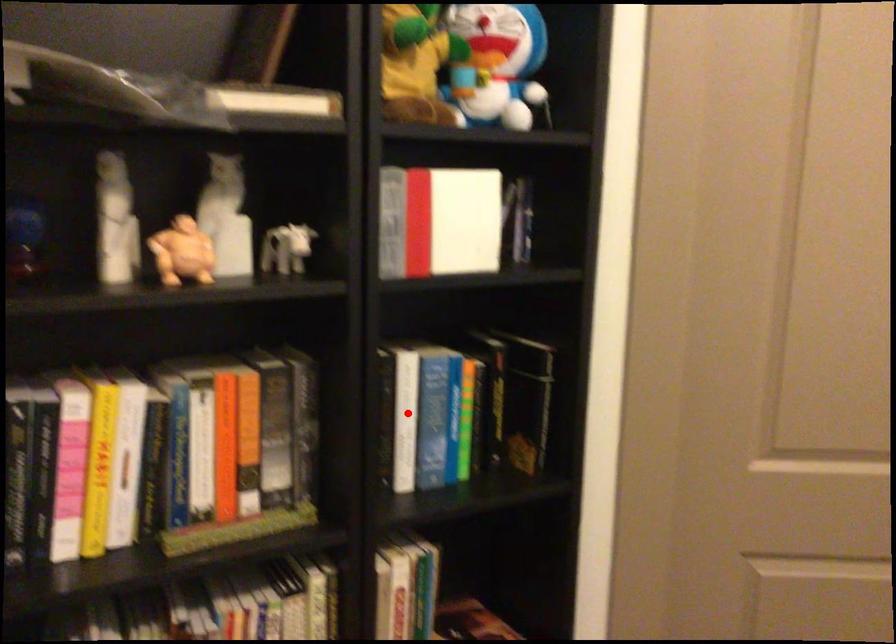
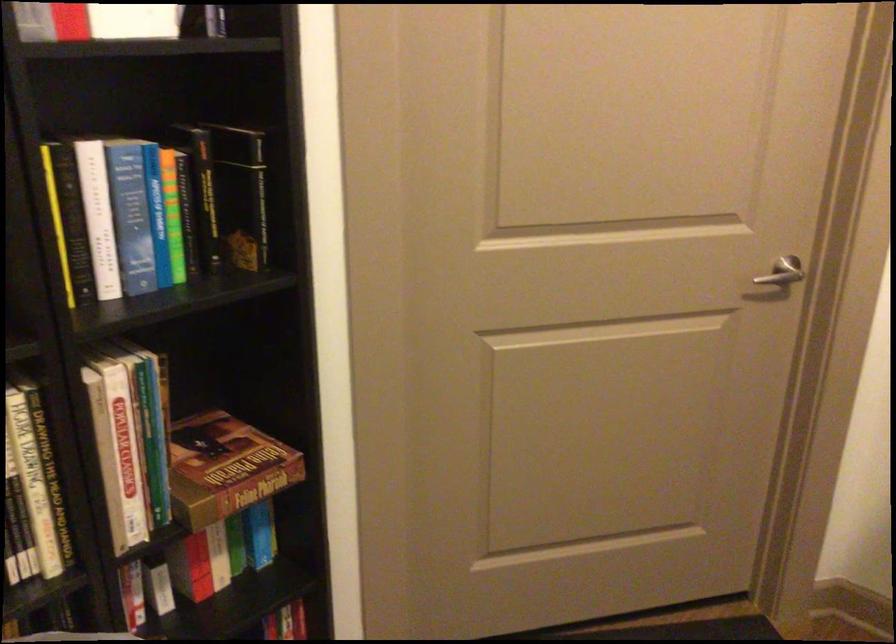
Find the pixel in the second image that matches the highlighted location in the first image.

(98, 216)